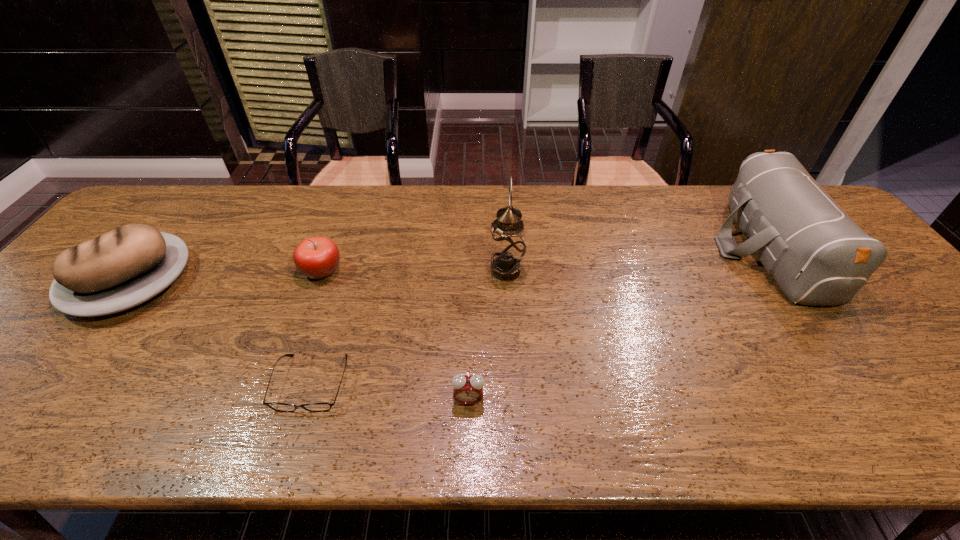
The width and height of the screenshot is (960, 540). I want to click on vacant space that is in between the shortest object and the tallest object, so click(409, 327).

Where is `empty space that is in between the apple and the leftmost object`? The width and height of the screenshot is (960, 540). empty space that is in between the apple and the leftmost object is located at coordinates (227, 276).

The image size is (960, 540). In order to click on free space between the apple and the third object from right to left in this screenshot , I will do (x=396, y=335).

What are the coordinates of `vacant space that's between the fifth tallest object and the spectacles` in the screenshot? It's located at (390, 392).

What are the coordinates of `vacant area that lies between the shortest object and the rightmost object` in the screenshot? It's located at (540, 316).

Choose which object is the fifth nearest neighbor to the second object from right to left. Please provide its 2D coordinates. Your answer should be formatted as a tuple, i.e. [(x, y)], where the tuple contains the x and y coordinates of a point satisfying the conditions above.

[(127, 266)]

Locate which object ranks third in proximity to the spectacles. Please provide its 2D coordinates. Your answer should be formatted as a tuple, i.e. [(x, y)], where the tuple contains the x and y coordinates of a point satisfying the conditions above.

[(127, 266)]

At what (x,y) coordinates should I click in order to perform the action: click on vacant position in the image that satisfies the following two spatial constraints: 1. on the back side of the third tallest object; 2. on the right side of the fifth object from left to right. Please return your answer as a coordinate pair (x, y). Looking at the image, I should click on (138, 271).